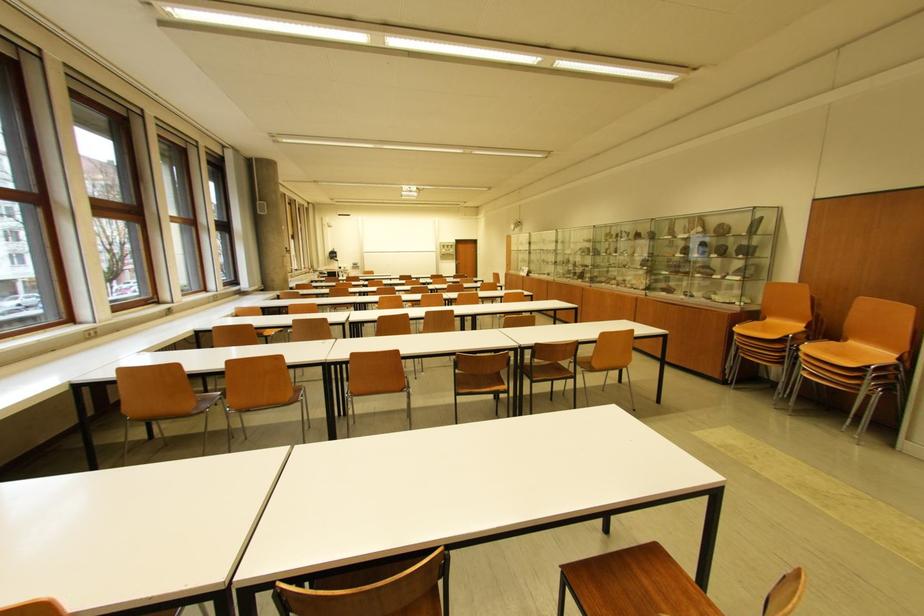
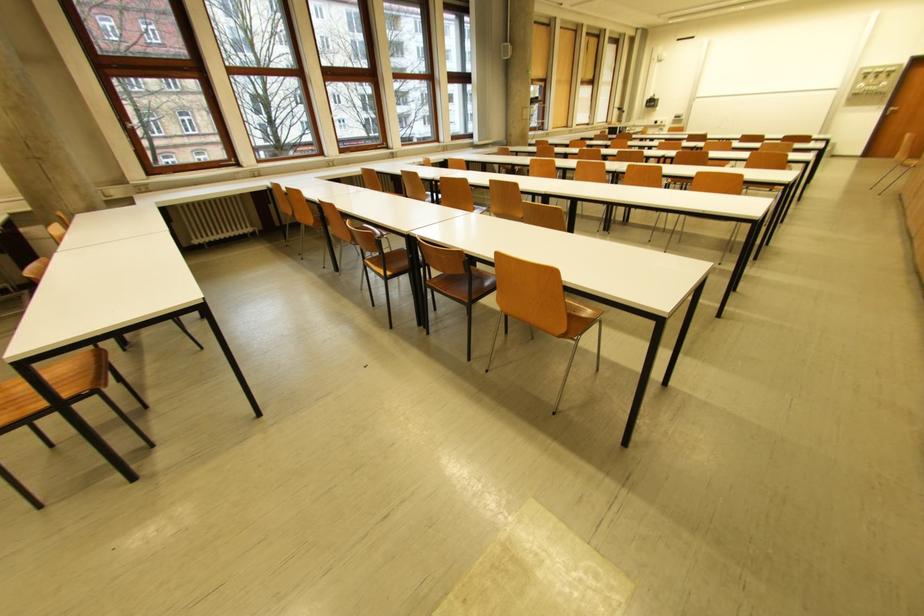
Locate, in the second image, the point that corresponds to point (456, 248) in the first image.

(890, 77)